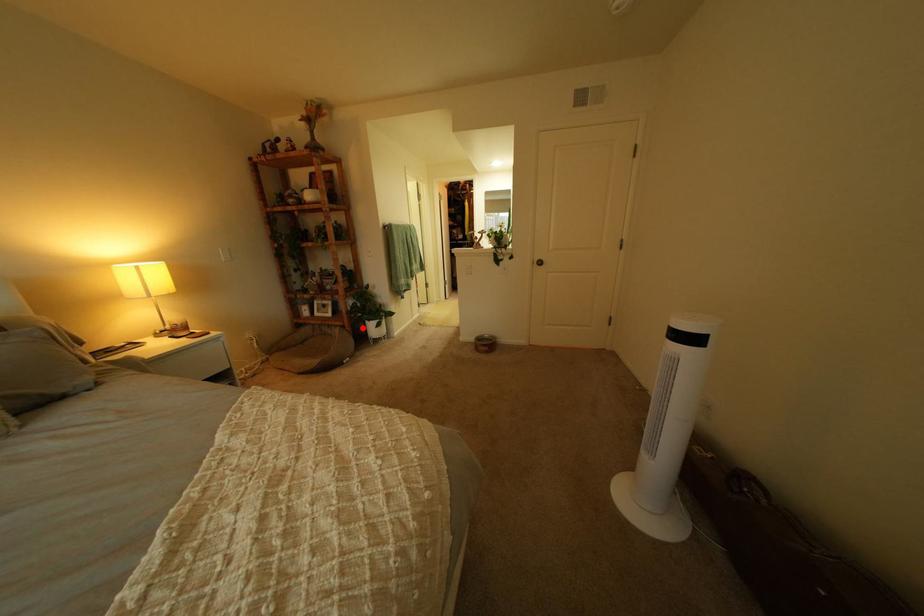
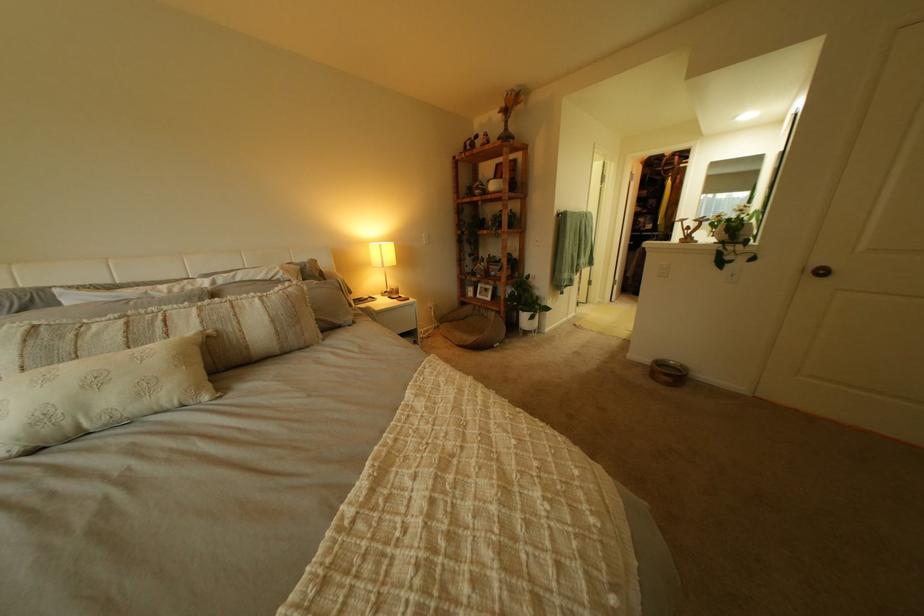
The point at the highlighted location is marked in the first image. Where is the corresponding point in the second image?

(517, 314)